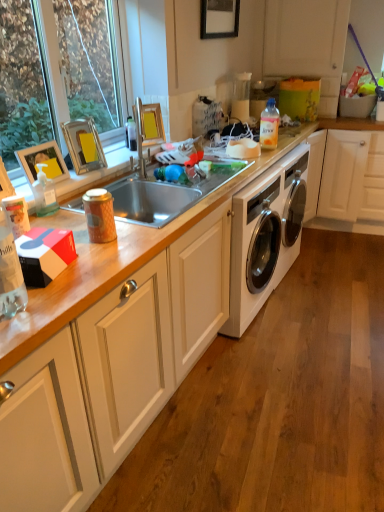
This screenshot has height=512, width=384. Identify the location of vacant space to the right of silver metallic picture frame at upper left, which is the 2th picture frame in left-to-right order. (114, 165).